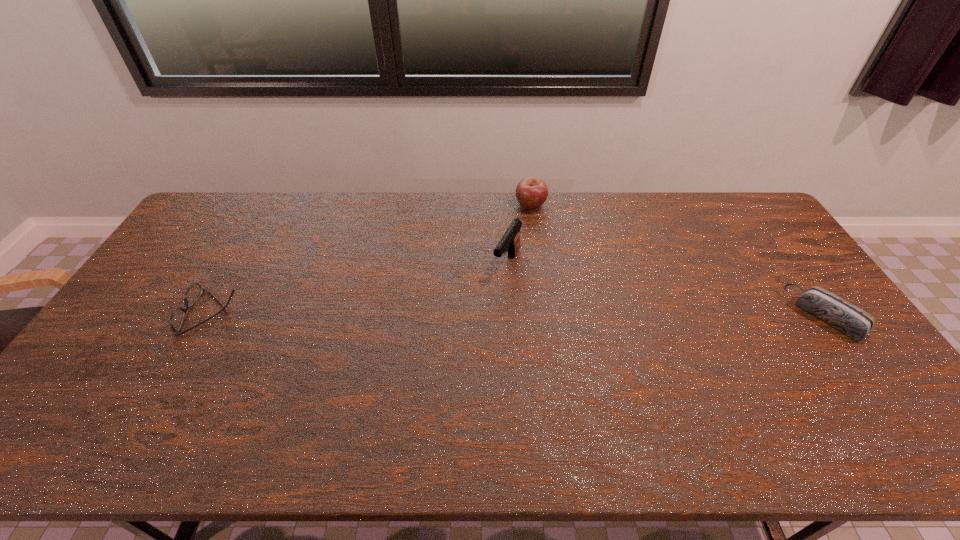
This screenshot has height=540, width=960. Identify the location of the shortest object. (193, 293).

The width and height of the screenshot is (960, 540). Identify the location of the leftmost object. (193, 293).

This screenshot has height=540, width=960. In order to click on pencil box in this screenshot , I will do `click(837, 312)`.

Find the location of a particular element. This screenshot has height=540, width=960. the third tallest object is located at coordinates (x=837, y=312).

At what (x,y) coordinates should I click in order to perform the action: click on the farthest object. Please return your answer as a coordinate pair (x, y). This screenshot has width=960, height=540. Looking at the image, I should click on (531, 193).

Where is `the third shortest object`? the third shortest object is located at coordinates (531, 193).

At what (x,y) coordinates should I click in order to perform the action: click on the second farthest object. Please return your answer as a coordinate pair (x, y). The height and width of the screenshot is (540, 960). Looking at the image, I should click on (510, 242).

Find the location of `pistol`. pistol is located at coordinates pos(510,242).

This screenshot has width=960, height=540. I want to click on vacant space situated 0.070m on the front-facing side of the leftmost object, so click(161, 313).

Find the location of a particular element. The height and width of the screenshot is (540, 960). vacant space located on the front-facing side of the leftmost object is located at coordinates (165, 313).